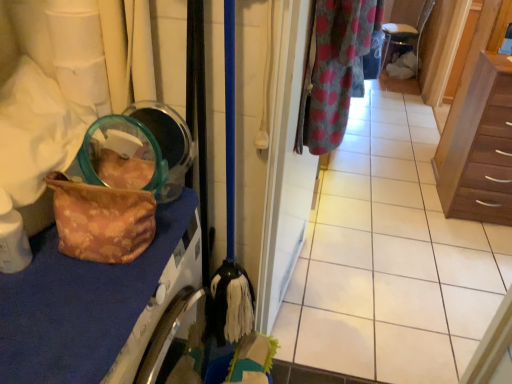
Question: Does point (454, 135) appear closer or farther from the camera than point (361, 6)?

Choices:
 (A) farther
 (B) closer

Answer: (A)

Question: Considering their positions, is brown wood chest of drawers at right located in front of or behind gray polka dot fabric at upper right?

Choices:
 (A) front
 (B) behind

Answer: (B)

Question: Estimate the real-world distances between objects in this image. Which object is closer to the floral fabric bag at left?

Choices:
 (A) gray polka dot fabric at upper right
 (B) polka dot fabric door at center
 (C) brown wood chest of drawers at right

Answer: (B)

Question: Considering the real-world distances, which object is closest to the floral fabric bag at left?

Choices:
 (A) brown wood chest of drawers at right
 (B) polka dot fabric door at center
 (C) gray polka dot fabric at upper right

Answer: (B)